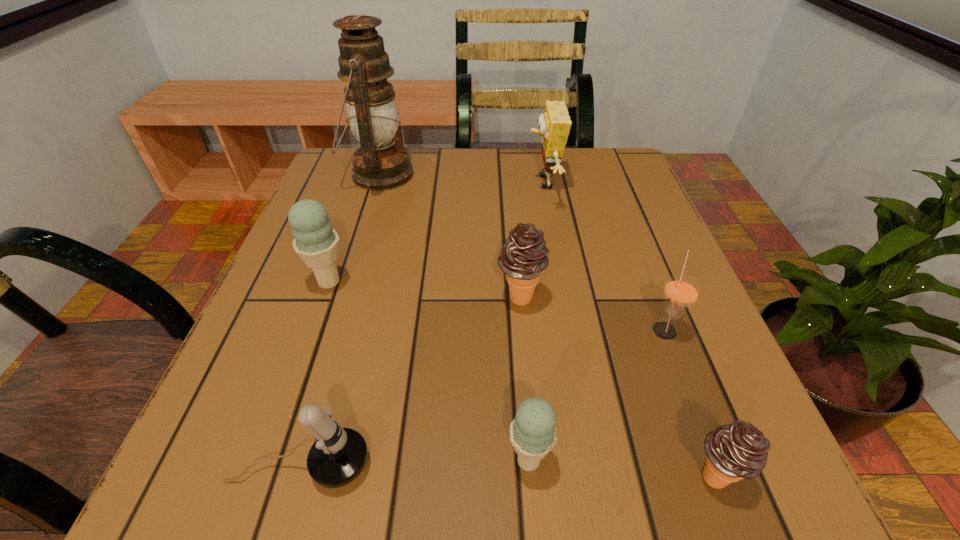
Find the location of a particular element. The width and height of the screenshot is (960, 540). lantern is located at coordinates (380, 164).

What are the coordinates of `yellow sponge` in the screenshot? It's located at (554, 124).

Locate an element on the screen. Image resolution: width=960 pixels, height=540 pixels. the left blue ice cream is located at coordinates (317, 244).

At what (x,y) coordinates should I click in order to perform the action: click on the leftmost icecream. Please return your answer as a coordinate pair (x, y). Looking at the image, I should click on (317, 244).

This screenshot has height=540, width=960. In order to click on the bigger chocolate icecream in this screenshot , I will do `click(523, 258)`.

Identify the location of the left chocolate icecream. 523,258.

Identify the location of the fifth farthest object. (681, 291).

Find the location of a particular element. This screenshot has width=960, height=540. white microphone is located at coordinates (337, 457).

Locate an element on the screen. Image resolution: width=960 pixels, height=540 pixels. the smaller blue ice cream is located at coordinates (533, 434).

This screenshot has width=960, height=540. I want to click on the nearer blue ice cream, so click(533, 434).